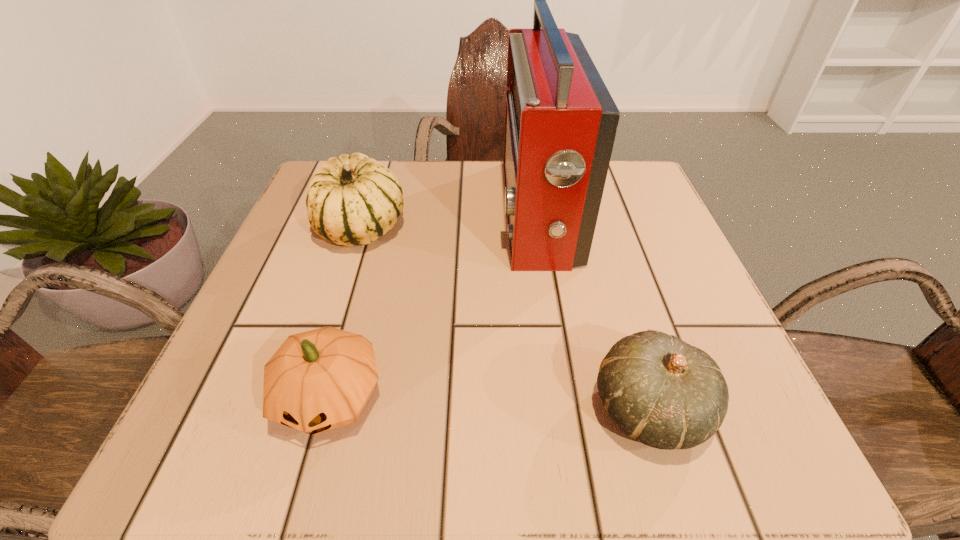
Identify the location of radio receiver. Image resolution: width=960 pixels, height=540 pixels. (560, 120).

At what (x,y) coordinates should I click in order to perform the action: click on the tallest gourd. Please return your answer as a coordinate pair (x, y). The height and width of the screenshot is (540, 960). Looking at the image, I should click on (353, 199).

Locate an element on the screen. the farthest gourd is located at coordinates (353, 199).

Image resolution: width=960 pixels, height=540 pixels. Identify the location of the rightmost gourd. (665, 393).

Locate an element on the screen. The height and width of the screenshot is (540, 960). free spot located on the front-facing side of the tallest object is located at coordinates (353, 213).

This screenshot has width=960, height=540. Identify the location of vacant region located on the front-facing side of the tallest object. (393, 213).

This screenshot has width=960, height=540. I want to click on vacant point located on the front-facing side of the tallest object, so click(413, 213).

Identify the location of vacant space positioned 0.400m on the right of the second tallest object. The height and width of the screenshot is (540, 960). (612, 227).

What are the coordinates of `vacant space located 0.210m on the back of the rightmost gourd` in the screenshot? It's located at (606, 264).

Image resolution: width=960 pixels, height=540 pixels. What are the coordinates of `radio receiver at the far edge` in the screenshot? It's located at (560, 120).